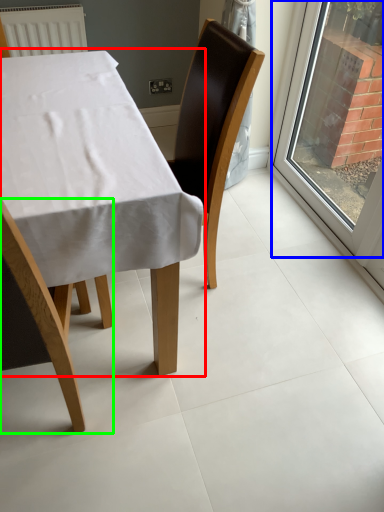
Question: Estimate the real-world distances between objects in this image. Which object is closer to table (highlighted by a red box), window (highlighted by a blue box) or chair (highlighted by a green box)?

Choices:
 (A) window
 (B) chair

Answer: (B)